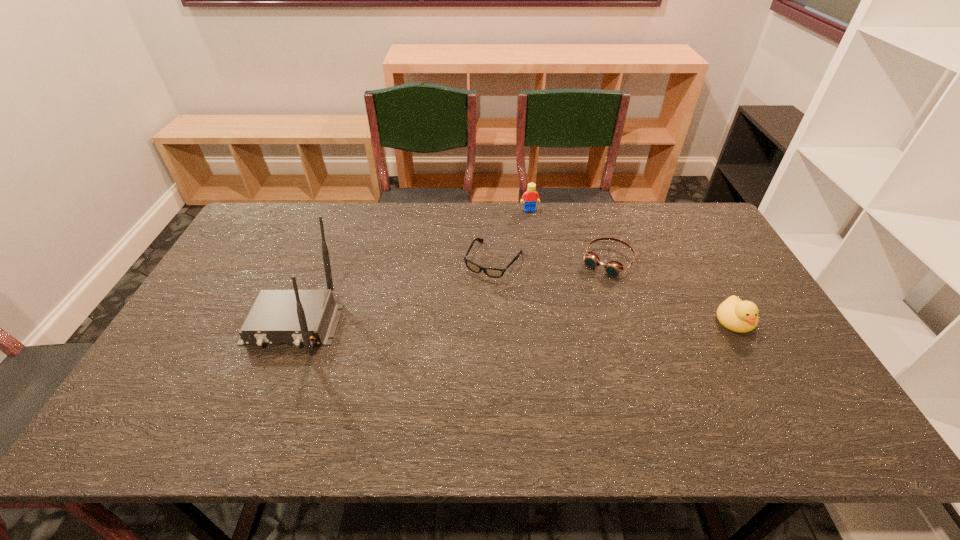
Where is `router`? This screenshot has width=960, height=540. router is located at coordinates (296, 317).

You are a GUI agent. You are given a task and a screenshot of the screen. Output one action in this format:
    pyautogui.click(x=<x>, y=<y>)
    Task: Click on the leftmost object
    
    Given the screenshot: What is the action you would take?
    pyautogui.click(x=296, y=317)

Identify the location of the rightmost object. The image size is (960, 540). (734, 314).

In order to click on duckling in this screenshot , I will do `click(734, 314)`.

Find the location of `the second object from left to right`. the second object from left to right is located at coordinates (490, 272).

The height and width of the screenshot is (540, 960). What are the coordinates of `the third object from right to left` in the screenshot? It's located at (530, 195).

Identify the location of the fourth shortest object. The width and height of the screenshot is (960, 540). (530, 195).

Where is `goggles`? This screenshot has height=540, width=960. goggles is located at coordinates (613, 268).

Find the location of `free point located on the back of the router to connect cables`. free point located on the back of the router to connect cables is located at coordinates (266, 390).

In order to click on vacant space situated 0.160m on the face of the third shortest object in this screenshot , I will do `click(774, 389)`.